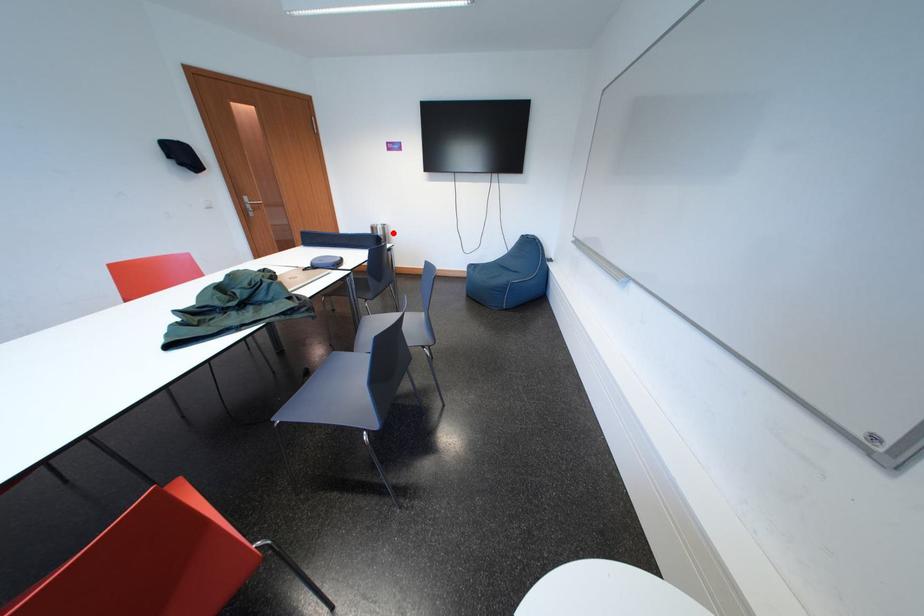
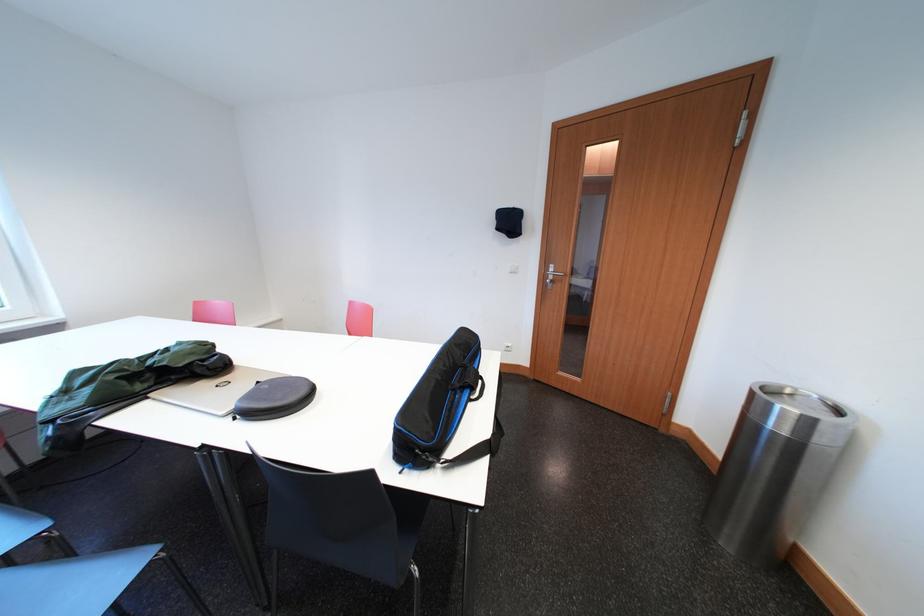
In the second image, find the point that corresponds to the highlighted location in the first image.

(819, 426)